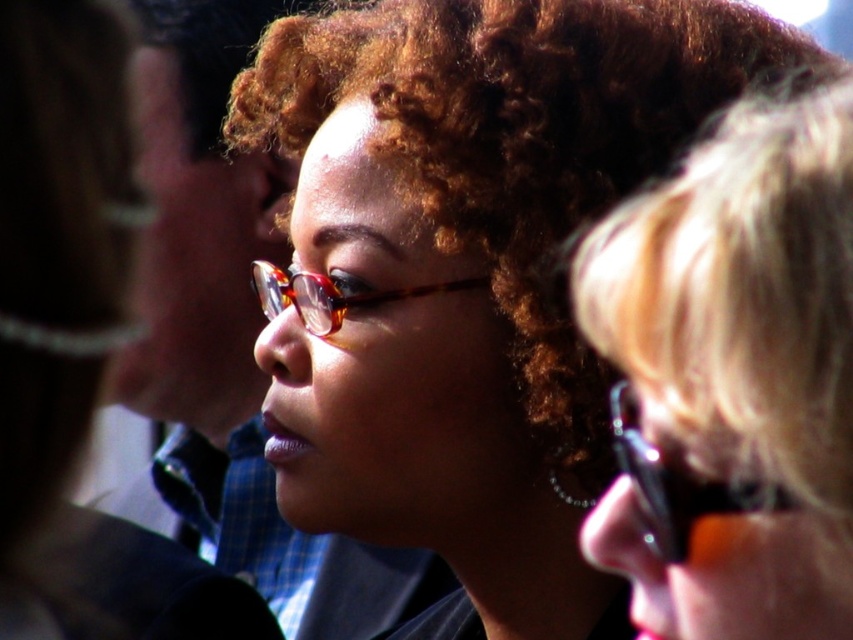
Question: Observing the image, what is the correct spatial positioning of matte black glasses at upper right in reference to tortoiseshell glasses at center?

Choices:
 (A) below
 (B) above

Answer: (A)

Question: Which object is positioned farthest from the matte brown hair at center?

Choices:
 (A) matte black glasses at upper right
 (B) transparent plastic goggles at right
 (C) tortoiseshell glasses at center

Answer: (B)

Question: Is matte brown hair at center to the left of matte black glasses at upper right from the viewer's perspective?

Choices:
 (A) no
 (B) yes

Answer: (B)

Question: Based on their relative distances, which object is nearer to the matte brown hair at center?

Choices:
 (A) matte black glasses at upper right
 (B) transparent plastic goggles at right
 (C) tortoiseshell glasses at center

Answer: (C)

Question: Which object is positioned farthest from the matte brown hair at center?

Choices:
 (A) tortoiseshell glasses at center
 (B) matte black glasses at upper right
 (C) transparent plastic goggles at right

Answer: (C)

Question: Is matte brown hair at center smaller than tortoiseshell glasses at center?

Choices:
 (A) no
 (B) yes

Answer: (A)